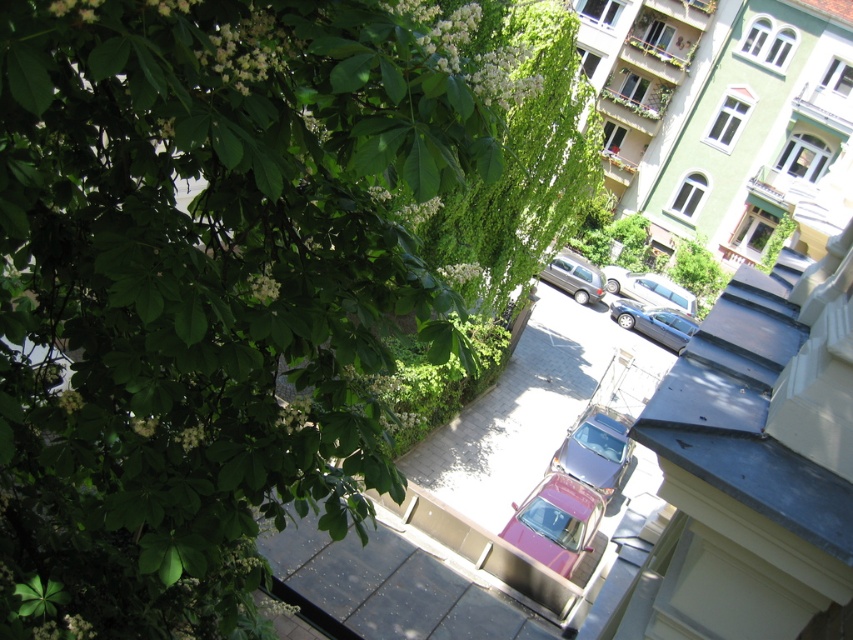
In order to click on metallic silver car at center in this screenshot , I will do `click(595, 449)`.

The height and width of the screenshot is (640, 853). What do you see at coordinates (595, 449) in the screenshot?
I see `metallic silver car at center` at bounding box center [595, 449].

Between point (582, 480) and point (676, 349), which one is positioned behind?

Point (676, 349)

Identify the location of metallic silver car at center. The height and width of the screenshot is (640, 853). (595, 449).

Between point (219, 221) and point (352, 577), which one is positioned behind?

Positioned behind is point (352, 577).

Does green leafy tree at upper left have a greater height compared to metallic gray alley at center?

No, green leafy tree at upper left is not taller than metallic gray alley at center.

At what (x,y) coordinates should I click in order to perform the action: click on green leafy tree at upper left. Please return your answer as a coordinate pair (x, y). Image resolution: width=853 pixels, height=640 pixels. Looking at the image, I should click on (206, 289).

Is metallic blue sedan at center to the right of satin silver van at center from the viewer's perspective?

Yes, metallic blue sedan at center is to the right of satin silver van at center.

Which is in front, point (640, 317) or point (569, 289)?

Point (640, 317)

What are the coordinates of `metallic blue sedan at center` in the screenshot? It's located at (654, 323).